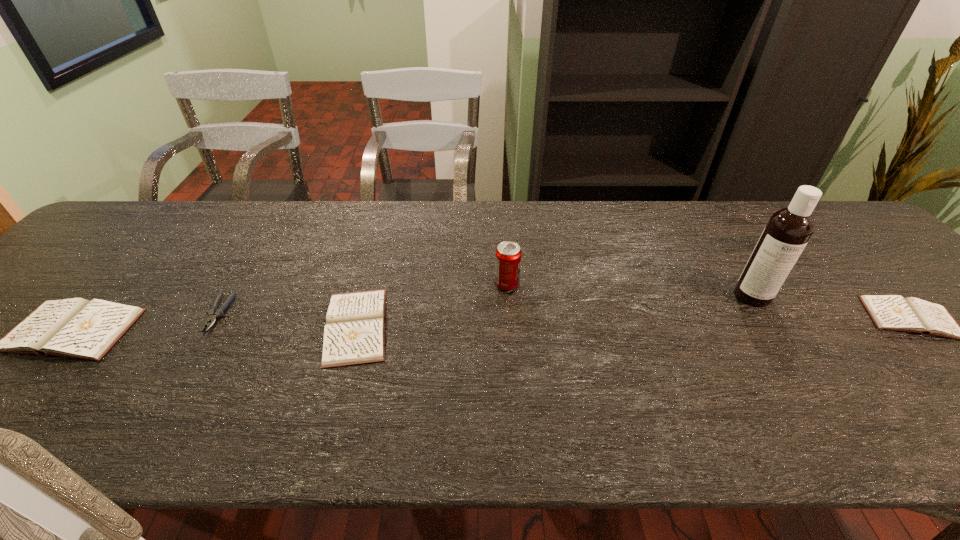
In order to click on free point between the pliers and the second tallest diary in this screenshot , I will do `click(287, 320)`.

The width and height of the screenshot is (960, 540). What are the coordinates of `vacant area that lies between the second tallest object and the second tallest diary` in the screenshot? It's located at (432, 305).

You are a GUI agent. You are given a task and a screenshot of the screen. Output one action in this format:
    pyautogui.click(x=<x>, y=<y>)
    Task: Click on the free space between the pliers and the dishwasher detergent
    
    Given the screenshot: What is the action you would take?
    pyautogui.click(x=485, y=305)

Find the location of a particular element. This screenshot has height=540, width=960. object that is the second closest to the pliers is located at coordinates (354, 333).

Image resolution: width=960 pixels, height=540 pixels. I want to click on object that is the third closest to the shortest diary, so tap(354, 333).

I want to click on diary that is the second closest to the third object from left to right, so 890,312.

Identify which diary is the nearest to the second shortest object. Please provide its 2D coordinates. Your answer should be formatted as a tuple, i.e. [(x, y)], where the tuple contains the x and y coordinates of a point satisfying the conditions above.

[(354, 333)]